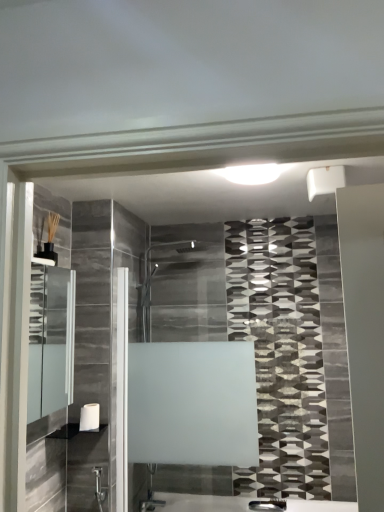
Question: Should I look upward or downward to see white matte towel bar at lower left?

Choices:
 (A) down
 (B) up

Answer: (A)

Question: Is clear glass medicine cabinet at left smaller than white matte towel bar at lower left?

Choices:
 (A) no
 (B) yes

Answer: (A)

Question: From a real-world perspective, does clear glass medicine cabinet at left sit lower than white matte towel bar at lower left?

Choices:
 (A) no
 (B) yes

Answer: (A)

Question: Could you tell me if clear glass medicine cabinet at left is turned towards white matte towel bar at lower left?

Choices:
 (A) no
 (B) yes

Answer: (A)

Question: Can white matte towel bar at lower left be found inside clear glass medicine cabinet at left?

Choices:
 (A) yes
 (B) no

Answer: (B)

Question: Is clear glass medicine cabinet at left wider than white matte towel bar at lower left?

Choices:
 (A) no
 (B) yes

Answer: (B)

Question: Can we say clear glass medicine cabinet at left lies outside white matte towel bar at lower left?

Choices:
 (A) no
 (B) yes

Answer: (B)

Question: From the image's perspective, is white glossy shelf at lower left above white matte towel bar at lower left?

Choices:
 (A) no
 (B) yes

Answer: (A)

Question: Is white glossy shelf at lower left not inside white matte towel bar at lower left?

Choices:
 (A) no
 (B) yes

Answer: (B)

Question: Considering the relative sizes of white glossy shelf at lower left and white matte towel bar at lower left in the image provided, is white glossy shelf at lower left taller than white matte towel bar at lower left?

Choices:
 (A) yes
 (B) no

Answer: (B)

Question: Is white glossy shelf at lower left wider than white matte towel bar at lower left?

Choices:
 (A) yes
 (B) no

Answer: (A)

Question: Does white glossy shelf at lower left appear on the left side of white matte towel bar at lower left?

Choices:
 (A) yes
 (B) no

Answer: (A)

Question: Is white glossy shelf at lower left surrounding white matte towel bar at lower left?

Choices:
 (A) yes
 (B) no

Answer: (B)

Question: Are clear glass medicine cabinet at left and white glossy shelf at lower left making contact?

Choices:
 (A) yes
 (B) no

Answer: (B)